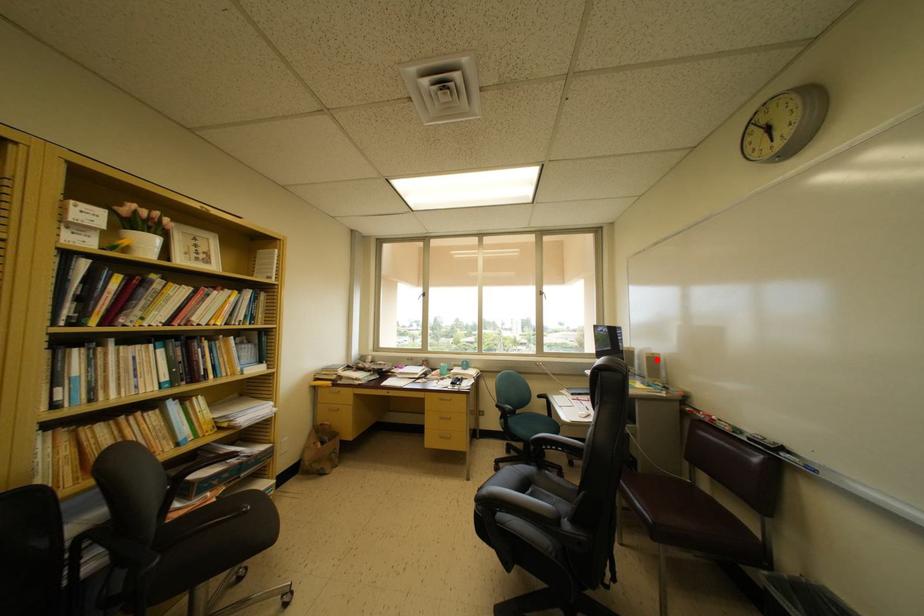
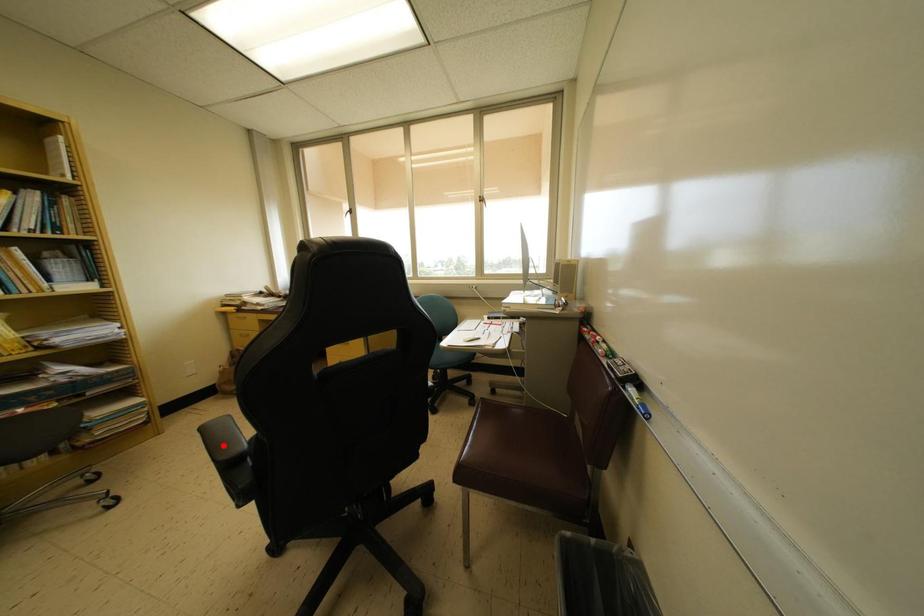
I am providing you with two images of the same scene from different viewpoints. A red point is marked on the first image and another point is marked on the second image. Do the highlighted points in image1 and image2 indicate the same real-world spot?

No